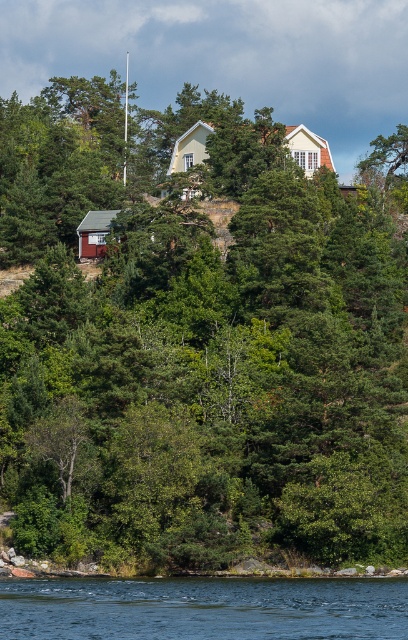
Question: Is transparent blue water at lower center further to the viewer compared to yellow matte house at center?

Choices:
 (A) yes
 (B) no

Answer: (B)

Question: Which object is positioned closest to the yellow matte house at center?

Choices:
 (A) transparent blue water at lower center
 (B) red wooden hut at lower left

Answer: (B)

Question: Is transparent blue water at lower center to the left of yellow matte house at center from the viewer's perspective?

Choices:
 (A) no
 (B) yes

Answer: (B)

Question: Among these objects, which one is farthest from the camera?

Choices:
 (A) transparent blue water at lower center
 (B) yellow matte house at center

Answer: (B)

Question: Which of the following is the farthest from the observer?

Choices:
 (A) (84, 218)
 (B) (286, 598)

Answer: (A)

Question: Does yellow matte house at center have a smaller size compared to red wooden hut at lower left?

Choices:
 (A) no
 (B) yes

Answer: (A)